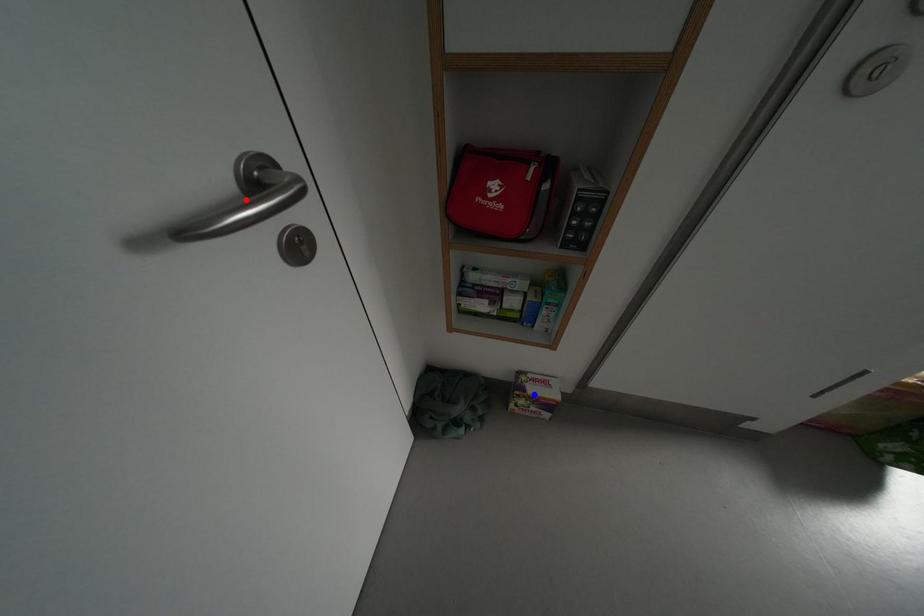
Question: Which of the two points in the image is closer to the camera?

Choices:
 (A) Blue point is closer.
 (B) Red point is closer.

Answer: (B)